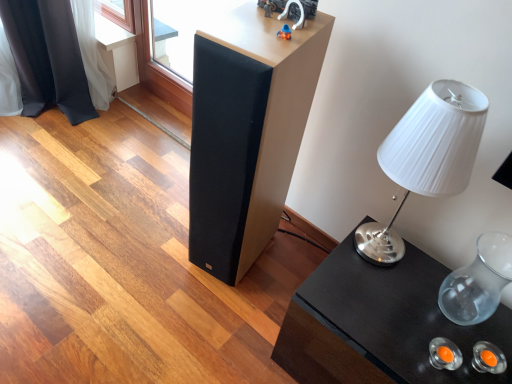
The height and width of the screenshot is (384, 512). In order to click on free area below white pleated fabric lampshade at right (from a real-world perspective) in this screenshot , I will do `click(367, 250)`.